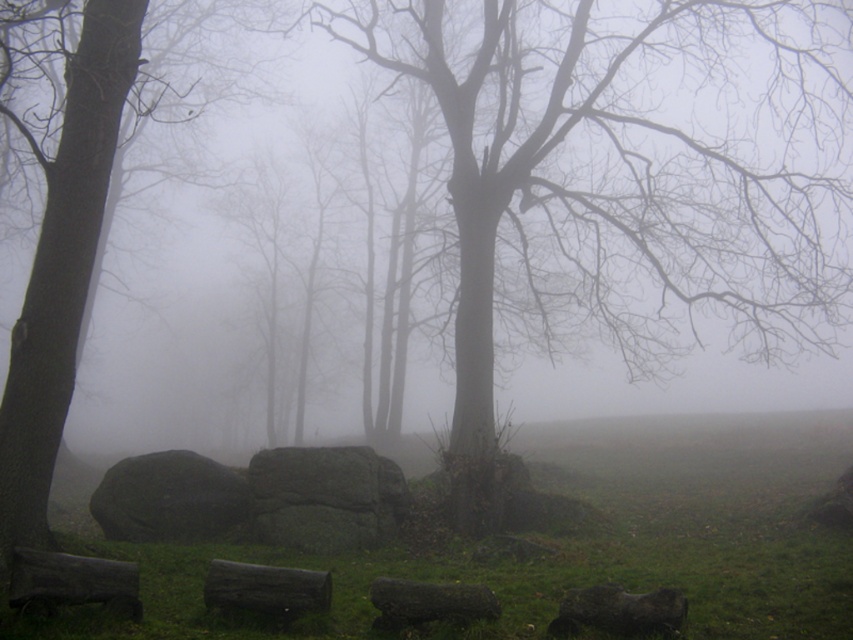
You are a hiker carrying a backpack and need to cross between the dark brown wood at lower left and the dark brown wood at center. The path between them is narrow. If your backpack is 0.5 meters wide, can you safely pass through the gap without touching either dark brown wood?

The dark brown wood at lower left is 1.06 meters from dark brown wood at center. Since your backpack is 0.5 meters wide, there is enough space to pass safely as the gap is wider than the backpack.

You are standing in the forest and want to locate the smooth gray tree trunk at left. Based on the coordinates provided, in which direction should you look to find it?

The smooth gray tree trunk at left is located at coordinates point (x=61, y=224), so you should look to the left side of the scene.

You are a hiker trying to determine the best path through the forest. You notice two landmarks ahead of you. The first is a smooth gray tree trunk at left, and the second is a dark brown wood at center. Which tree trunk is wider?

The smooth gray tree trunk at left is wider than the dark brown wood at center.